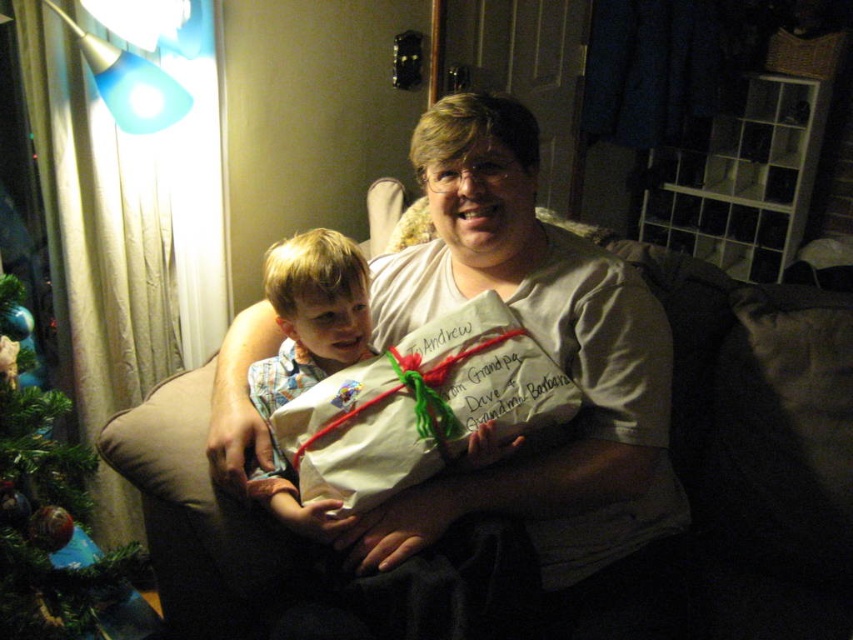
The height and width of the screenshot is (640, 853). Identify the location of brown fabric couch at center. (757, 444).

Can you confirm if brown fabric couch at center is taller than light brown fabric shirt at center?

Correct, brown fabric couch at center is much taller as light brown fabric shirt at center.

The width and height of the screenshot is (853, 640). What do you see at coordinates (757, 444) in the screenshot? I see `brown fabric couch at center` at bounding box center [757, 444].

Locate an element on the screen. The image size is (853, 640). brown fabric couch at center is located at coordinates (757, 444).

Looking at this image, is green matte christmas tree at left wider than light brown fabric shirt at center?

No, green matte christmas tree at left is not wider than light brown fabric shirt at center.

What do you see at coordinates (55, 532) in the screenshot? The height and width of the screenshot is (640, 853). I see `green matte christmas tree at left` at bounding box center [55, 532].

The width and height of the screenshot is (853, 640). What do you see at coordinates (55, 532) in the screenshot?
I see `green matte christmas tree at left` at bounding box center [55, 532].

The image size is (853, 640). Find the location of `green matte christmas tree at left`. green matte christmas tree at left is located at coordinates (55, 532).

Is point (171, 460) farther from viewer compared to point (21, 440)?

Yes, point (171, 460) is farther from viewer.

Who is taller, brown fabric couch at center or green matte christmas tree at left?

With more height is brown fabric couch at center.

Does point (805, 492) come behind point (0, 426)?

Yes, it is.

The width and height of the screenshot is (853, 640). I want to click on brown fabric couch at center, so click(757, 444).